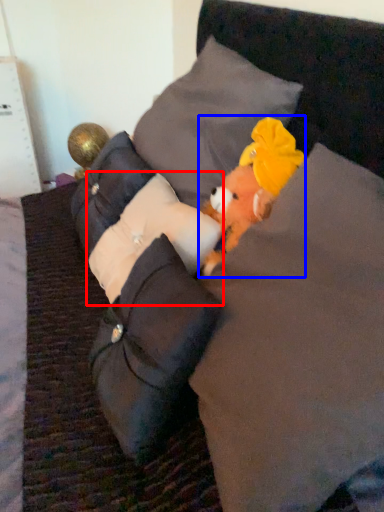
Question: Among these objects, which one is farthest to the camera, pillow (highlighted by a red box) or toy (highlighted by a blue box)?

Choices:
 (A) pillow
 (B) toy

Answer: (A)